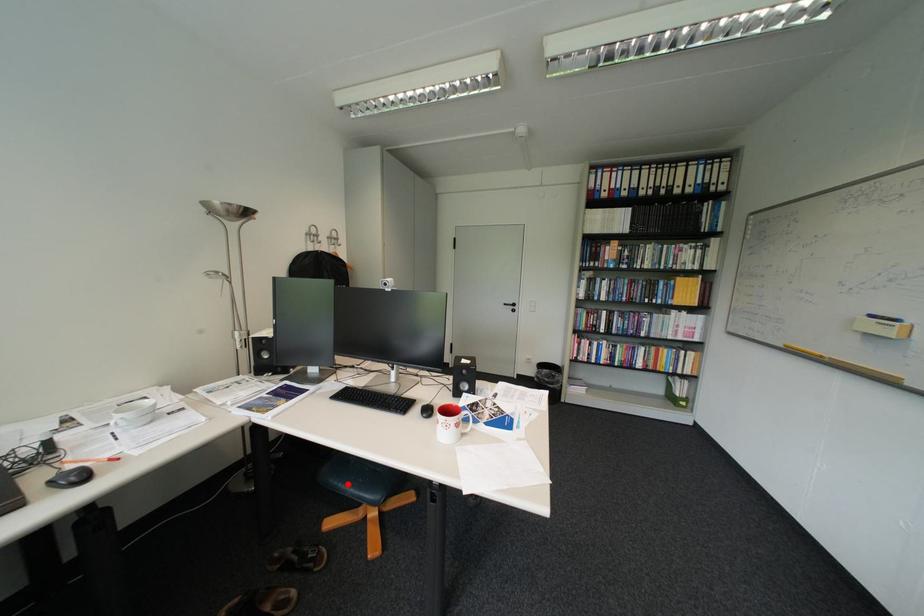
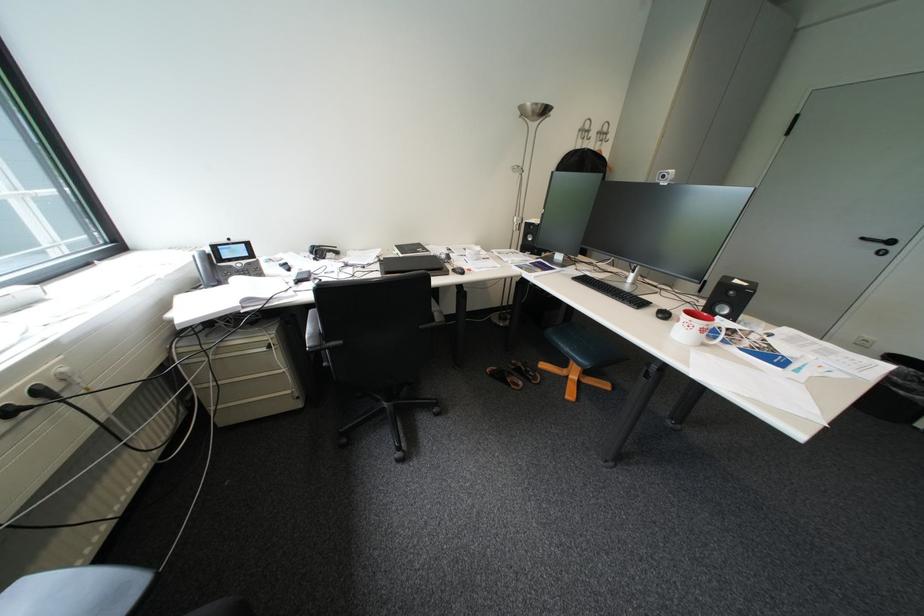
The point at the highlighted location is marked in the first image. Where is the corresponding point in the second image?

(569, 341)